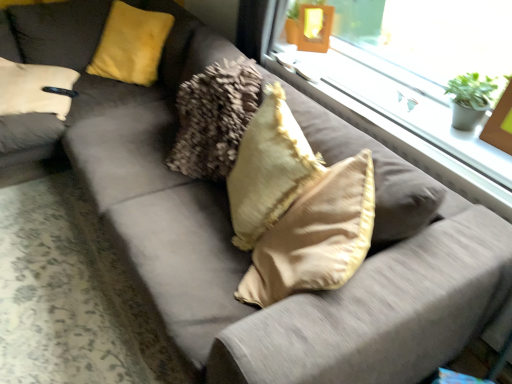
This screenshot has width=512, height=384. Describe the element at coordinates (470, 99) in the screenshot. I see `green matte houseplant at upper right` at that location.

You are a GUI agent. You are given a task and a screenshot of the screen. Output one action in this format:
    pyautogui.click(x=<x>, y=<y>)
    Task: Click on the clear glass window at upper right
    The width and height of the screenshot is (512, 384).
    Given the screenshot: What is the action you would take?
    pyautogui.click(x=406, y=108)

Locate an element on the screen. Image resolution: width=512 pixels, height=384 pixels. green matte houseplant at upper right is located at coordinates (470, 99).

Can you confirm if wooden picture frame at upper right is smaller than green matte houseplant at upper right?

Actually, wooden picture frame at upper right might be larger than green matte houseplant at upper right.

Is wooden picture frame at upper right with green matte houseplant at upper right?

Yes, wooden picture frame at upper right is right next to green matte houseplant at upper right and making contact.

Could you tell me if wooden picture frame at upper right is facing green matte houseplant at upper right?

No.

Between beige soft cushion at center, which ranks as the 1th pillow in bottom-to-top order, and green matte houseplant at upper right, which one appears on the left side from the viewer's perspective?

beige soft cushion at center, which ranks as the 1th pillow in bottom-to-top order, is more to the left.

The image size is (512, 384). I want to click on the 2nd pillow directly beneath the green matte houseplant at upper right (from a real-world perspective), so (269, 169).

Which is closer, (x=250, y=181) or (x=482, y=106)?

The point (x=250, y=181) is closer to the camera.

Does beige soft cushion at center, which ranks as the 1th pillow in bottom-to-top order, have a smaller size compared to green matte houseplant at upper right?

Incorrect, beige soft cushion at center, which ranks as the 1th pillow in bottom-to-top order, is not smaller in size than green matte houseplant at upper right.

Based on the photo, is yellow fuzzy pillow at upper left, which is counted as the 2th pillow, starting from the front, oriented towards beige soft cushion at center, which ranks as the 2th pillow in top-to-bottom order?

No, yellow fuzzy pillow at upper left, which is counted as the 2th pillow, starting from the front, is not oriented towards beige soft cushion at center, which ranks as the 2th pillow in top-to-bottom order.

From the image's perspective, is yellow fuzzy pillow at upper left, the 1th pillow in the top-to-bottom sequence, beneath beige soft cushion at center, positioned as the second pillow in left-to-right order?

Actually, yellow fuzzy pillow at upper left, the 1th pillow in the top-to-bottom sequence, appears above beige soft cushion at center, positioned as the second pillow in left-to-right order, in the image.

Considering the sizes of yellow fuzzy pillow at upper left, the first pillow positioned from the back, and beige soft cushion at center, which ranks as the 1th pillow in bottom-to-top order, in the image, is yellow fuzzy pillow at upper left, the first pillow positioned from the back, bigger or smaller than beige soft cushion at center, which ranks as the 1th pillow in bottom-to-top order,?

In the image, yellow fuzzy pillow at upper left, the first pillow positioned from the back, appears to be larger than beige soft cushion at center, which ranks as the 1th pillow in bottom-to-top order.

Considering the relative sizes of yellow fuzzy pillow at upper left, which is counted as the 2th pillow, starting from the front, and beige soft cushion at center, which ranks as the 2th pillow in top-to-bottom order, in the image provided, is yellow fuzzy pillow at upper left, which is counted as the 2th pillow, starting from the front, shorter than beige soft cushion at center, which ranks as the 2th pillow in top-to-bottom order,?

Correct, yellow fuzzy pillow at upper left, which is counted as the 2th pillow, starting from the front, is not as tall as beige soft cushion at center, which ranks as the 2th pillow in top-to-bottom order.

In the image, is green matte houseplant at upper right positioned in front of or behind yellow fuzzy pillow at upper left, arranged as the first pillow when viewed from the left?

Clearly, green matte houseplant at upper right is in front of yellow fuzzy pillow at upper left, arranged as the first pillow when viewed from the left.

Considering the relative sizes of green matte houseplant at upper right and yellow fuzzy pillow at upper left, the first pillow positioned from the back, in the image provided, is green matte houseplant at upper right smaller than yellow fuzzy pillow at upper left, the first pillow positioned from the back,?

Correct, green matte houseplant at upper right occupies less space than yellow fuzzy pillow at upper left, the first pillow positioned from the back.

How many degrees apart are the facing directions of green matte houseplant at upper right and yellow fuzzy pillow at upper left, the 1th pillow in the top-to-bottom sequence?

The facing directions of green matte houseplant at upper right and yellow fuzzy pillow at upper left, the 1th pillow in the top-to-bottom sequence, are 33.1 degrees apart.

Considering the sizes of objects green matte houseplant at upper right and yellow fuzzy pillow at upper left, the second pillow in the right-to-left sequence, in the image provided, who is wider, green matte houseplant at upper right or yellow fuzzy pillow at upper left, the second pillow in the right-to-left sequence,?

With larger width is yellow fuzzy pillow at upper left, the second pillow in the right-to-left sequence.

How distant is yellow fuzzy pillow at upper left, the second pillow in the right-to-left sequence, from wooden picture frame at upper right?

yellow fuzzy pillow at upper left, the second pillow in the right-to-left sequence, is 1.83 meters away from wooden picture frame at upper right.

Is yellow fuzzy pillow at upper left, the first pillow positioned from the back, in front of wooden picture frame at upper right?

No, yellow fuzzy pillow at upper left, the first pillow positioned from the back, is behind wooden picture frame at upper right.

Considering the positions of objects yellow fuzzy pillow at upper left, arranged as the first pillow when viewed from the left, and wooden picture frame at upper right in the image provided, who is more to the right, yellow fuzzy pillow at upper left, arranged as the first pillow when viewed from the left, or wooden picture frame at upper right?

wooden picture frame at upper right is more to the right.

Could you tell me if yellow fuzzy pillow at upper left, arranged as the first pillow when viewed from the left, is turned towards wooden picture frame at upper right?

No, yellow fuzzy pillow at upper left, arranged as the first pillow when viewed from the left, is not facing towards wooden picture frame at upper right.

You are a GUI agent. You are given a task and a screenshot of the screen. Output one action in this format:
    pyautogui.click(x=<x>, y=<y>)
    Task: Click on the houseplant on the right side of clear glass window at upper right
    This screenshot has width=512, height=384.
    Given the screenshot: What is the action you would take?
    pyautogui.click(x=470, y=99)

Which is more to the right, green matte houseplant at upper right or clear glass window at upper right?

green matte houseplant at upper right.

Considering the sizes of objects green matte houseplant at upper right and clear glass window at upper right in the image provided, who is bigger, green matte houseplant at upper right or clear glass window at upper right?

clear glass window at upper right is bigger.

Is green matte houseplant at upper right closer to the viewer compared to beige soft cushion at center, arranged as the 2th pillow when viewed from the back?

That is False.

Is green matte houseplant at upper right bigger than beige soft cushion at center, positioned as the second pillow in left-to-right order?

Actually, green matte houseplant at upper right might be smaller than beige soft cushion at center, positioned as the second pillow in left-to-right order.

From the image's perspective, is green matte houseplant at upper right located beneath beige soft cushion at center, positioned as the second pillow in left-to-right order?

Incorrect, from the image's perspective, green matte houseplant at upper right is higher than beige soft cushion at center, positioned as the second pillow in left-to-right order.

Locate an element on the screen. This screenshot has width=512, height=384. picture frame that is on the right side of green matte houseplant at upper right is located at coordinates (500, 123).

Find the location of a particular element. the 1st pillow to the left when counting from the green matte houseplant at upper right is located at coordinates (269, 169).

Estimate the real-world distances between objects in this image. Which object is further from beige soft cushion at center, the first pillow positioned from the right, green matte houseplant at upper right or yellow fuzzy pillow at upper left, the first pillow positioned from the back?

Among the two, yellow fuzzy pillow at upper left, the first pillow positioned from the back, is located further to beige soft cushion at center, the first pillow positioned from the right.

Based on their spatial positions, is clear glass window at upper right or beige soft cushion at center, arranged as the 2th pillow when viewed from the back, closer to green matte houseplant at upper right?

Based on the image, clear glass window at upper right appears to be nearer to green matte houseplant at upper right.

Considering their positions, is beige soft cushion at center, which ranks as the 1th pillow in bottom-to-top order, positioned further to green matte houseplant at upper right than yellow fuzzy pillow at upper left, the second pillow in the right-to-left sequence?

yellow fuzzy pillow at upper left, the second pillow in the right-to-left sequence, is positioned further to the anchor green matte houseplant at upper right.

From the image, which object appears to be nearer to clear glass window at upper right, green matte houseplant at upper right or wooden picture frame at upper right?

green matte houseplant at upper right is positioned closer to the anchor clear glass window at upper right.

Which object lies nearer to the anchor point clear glass window at upper right, wooden picture frame at upper right or green matte houseplant at upper right?

green matte houseplant at upper right.

Considering their positions, is beige soft cushion at center, which ranks as the 1th pillow in bottom-to-top order, positioned closer to green matte houseplant at upper right than wooden picture frame at upper right?

Based on the image, wooden picture frame at upper right appears to be nearer to green matte houseplant at upper right.

Based on their spatial positions, is green matte houseplant at upper right or wooden picture frame at upper right closer to beige soft cushion at center, which ranks as the 1th pillow in bottom-to-top order?

green matte houseplant at upper right is closer to beige soft cushion at center, which ranks as the 1th pillow in bottom-to-top order.

Based on their spatial positions, is beige soft cushion at center, the first pillow positioned from the right, or green matte houseplant at upper right closer to wooden picture frame at upper right?

The object closer to wooden picture frame at upper right is green matte houseplant at upper right.

Image resolution: width=512 pixels, height=384 pixels. In order to click on houseplant between yellow fuzzy pillow at upper left, the second pillow in the right-to-left sequence, and wooden picture frame at upper right from left to right in this screenshot , I will do `click(470, 99)`.

I want to click on window situated between yellow fuzzy pillow at upper left, which is counted as the 2th pillow, starting from the bottom, and green matte houseplant at upper right from left to right, so click(x=406, y=108).

What are the coordinates of `houseplant located between clear glass window at upper right and wooden picture frame at upper right in the left-right direction` in the screenshot? It's located at (470, 99).

Locate an element on the screen. Image resolution: width=512 pixels, height=384 pixels. pillow located between yellow fuzzy pillow at upper left, the second pillow in the right-to-left sequence, and clear glass window at upper right in the left-right direction is located at coordinates (269, 169).